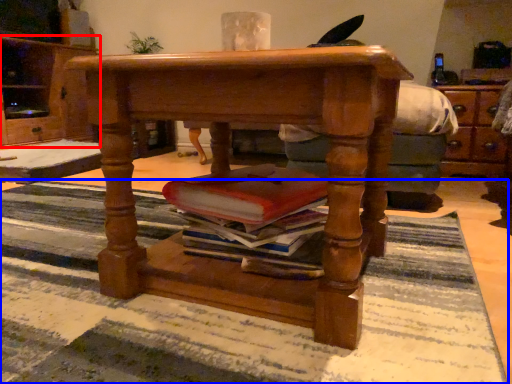
Question: Which of the following is the closest to the observer, cabinetry (highlighted by a red box) or mat (highlighted by a blue box)?

Choices:
 (A) cabinetry
 (B) mat

Answer: (B)